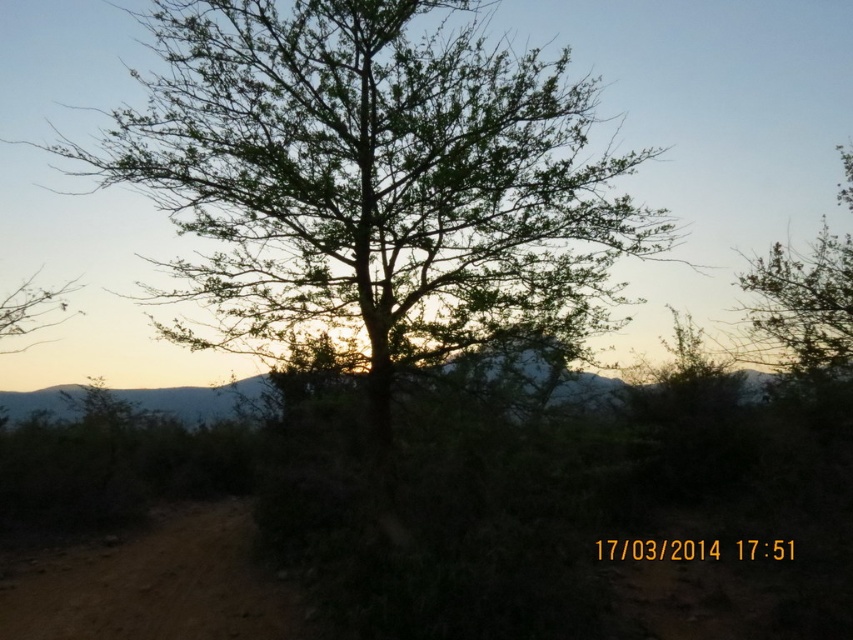
Question: Which point is closer to the camera?

Choices:
 (A) (332, 276)
 (B) (245, 540)

Answer: (A)

Question: Can you confirm if green leafy tree at center is positioned above brown sandy dirt track at lower left?

Choices:
 (A) no
 (B) yes

Answer: (B)

Question: Does green leafy tree at center have a greater width compared to brown sandy dirt track at lower left?

Choices:
 (A) no
 (B) yes

Answer: (B)

Question: Among these points, which one is farthest from the camera?

Choices:
 (A) (492, 234)
 (B) (80, 557)

Answer: (B)

Question: Is green leafy tree at center positioned at the back of brown sandy dirt track at lower left?

Choices:
 (A) no
 (B) yes

Answer: (A)